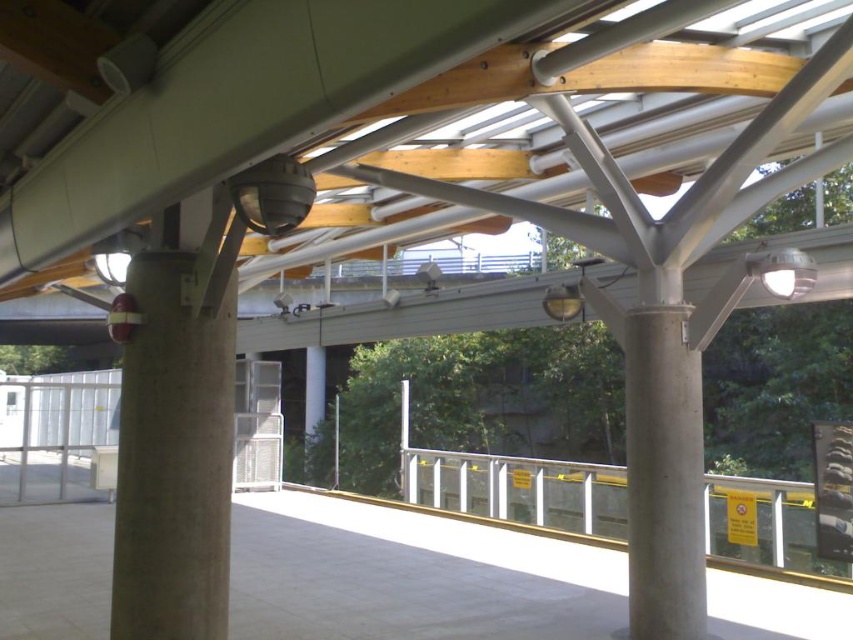
Question: Can you confirm if concrete at left is positioned below white concrete pillar at center?

Choices:
 (A) no
 (B) yes

Answer: (A)

Question: Can you confirm if concrete at left is wider than white concrete pillar at center?

Choices:
 (A) no
 (B) yes

Answer: (B)

Question: Which point appears farthest from the camera in this image?

Choices:
 (A) (161, 458)
 (B) (648, 376)

Answer: (B)

Question: Can you confirm if concrete at left is positioned to the right of white concrete pillar at center?

Choices:
 (A) no
 (B) yes

Answer: (A)